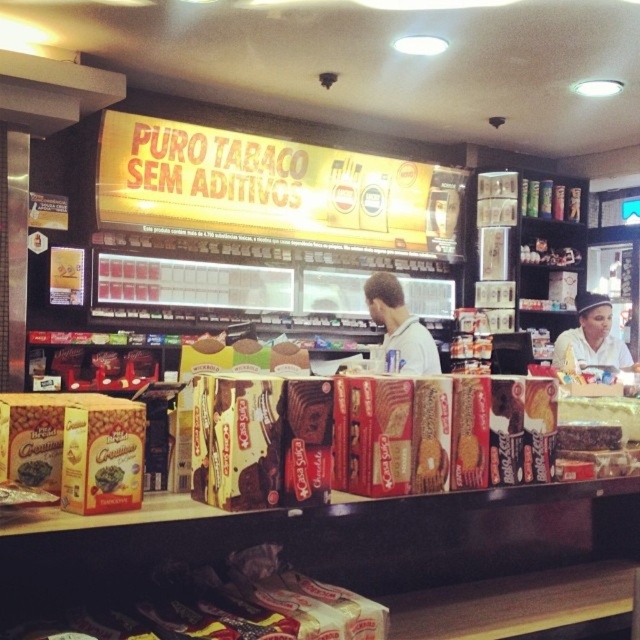
Does white uniform at right appear on the right side of shiny chocolate bar at center?

Indeed, white uniform at right is positioned on the right side of shiny chocolate bar at center.

Is point (604, 337) closer to camera compared to point (116, 467)?

That is False.

Who is more distant from viewer, (584, 353) or (100, 468)?

Positioned behind is point (584, 353).

The height and width of the screenshot is (640, 640). Identify the location of white uniform at right. (592, 337).

Does brown matte cookie at center have a greater width compared to shiny chocolate bar at center?

Indeed, brown matte cookie at center has a greater width compared to shiny chocolate bar at center.

Does brown matte cookie at center appear over shiny chocolate bar at center?

Yes, brown matte cookie at center is above shiny chocolate bar at center.

Is point (22, 484) positioned after point (116, 480)?

Yes, point (22, 484) is behind point (116, 480).

The width and height of the screenshot is (640, 640). Identify the location of brown matte cookie at center. (33, 472).

Which is more to the right, white uniform at right or brown matte cookie at center?

white uniform at right is more to the right.

Is white uniform at right positioned at the back of brown matte cookie at center?

Yes, white uniform at right is behind brown matte cookie at center.

Between point (600, 339) and point (22, 468), which one is positioned in front?

Point (22, 468) is more forward.

Locate an element on the screen. white uniform at right is located at coordinates (592, 337).